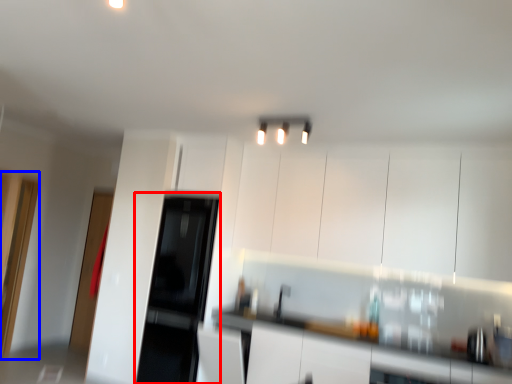
Question: Which object appears closest to the camera in this image, appliance (highlighted by a red box) or glass door (highlighted by a blue box)?

Choices:
 (A) appliance
 (B) glass door

Answer: (B)